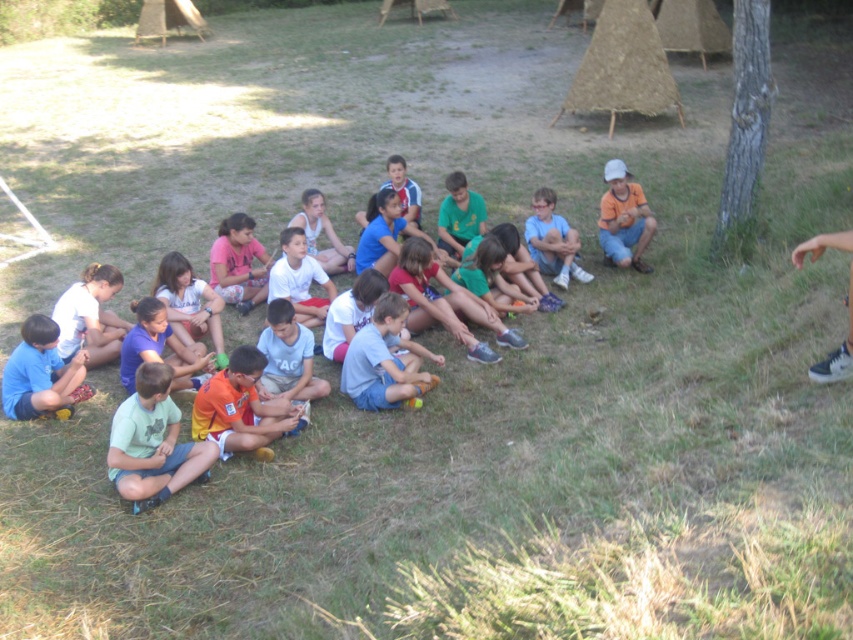
In the scene shown: Does green cotton shirt at lower left have a smaller size compared to orange cotton shirt at right?

Correct, green cotton shirt at lower left occupies less space than orange cotton shirt at right.

Can you confirm if green cotton shirt at lower left is positioned above orange cotton shirt at right?

Incorrect, green cotton shirt at lower left is not positioned above orange cotton shirt at right.

Does point (155, 378) lie behind point (643, 220)?

No, it is in front of (643, 220).

The height and width of the screenshot is (640, 853). In order to click on green cotton shirt at lower left in this screenshot , I will do `click(152, 442)`.

Describe the element at coordinates (427, 364) in the screenshot. I see `light blue t-shirt at center` at that location.

Who is more distant from viewer, (16, 337) or (167, 417)?

The point (16, 337) is more distant.

Does point (714, 321) come farther from viewer compared to point (157, 486)?

That is True.

Where is `light blue t-shirt at center`? light blue t-shirt at center is located at coordinates (x=427, y=364).

Is gray rough bark tree at upper right above blue t-shirt at center?

Correct, gray rough bark tree at upper right is located above blue t-shirt at center.

Does gray rough bark tree at upper right have a lesser width compared to blue t-shirt at center?

Yes, gray rough bark tree at upper right is thinner than blue t-shirt at center.

This screenshot has width=853, height=640. Identify the location of gray rough bark tree at upper right. (744, 125).

Find the location of a particular element. Image resolution: width=853 pixels, height=640 pixels. gray rough bark tree at upper right is located at coordinates (744, 125).